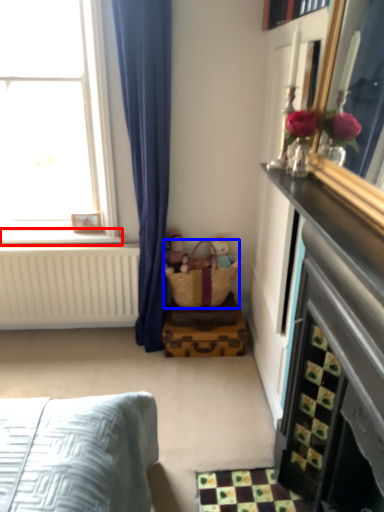
Question: Which object is closer to the camera taking this photo, window sill (highlighted by a red box) or basket (highlighted by a blue box)?

Choices:
 (A) window sill
 (B) basket

Answer: (B)